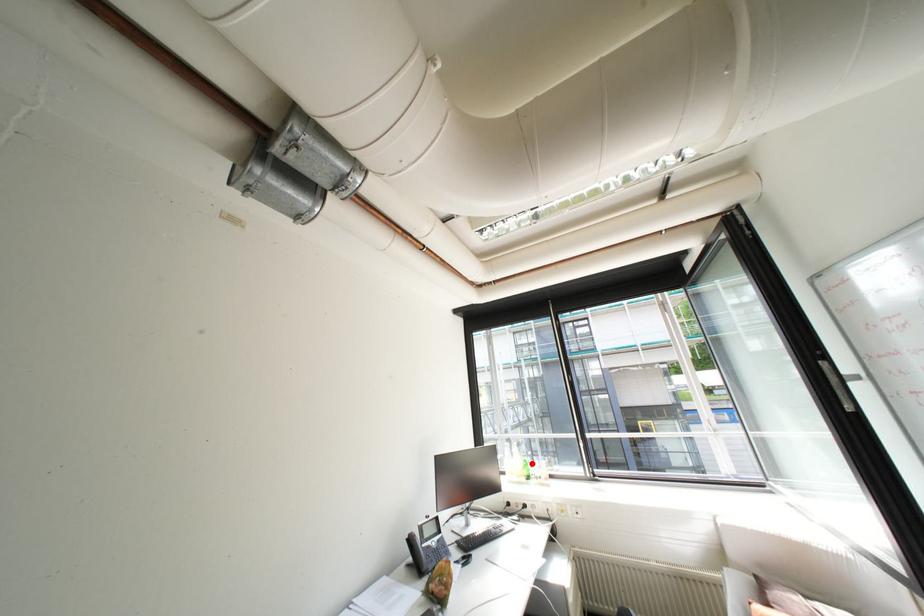
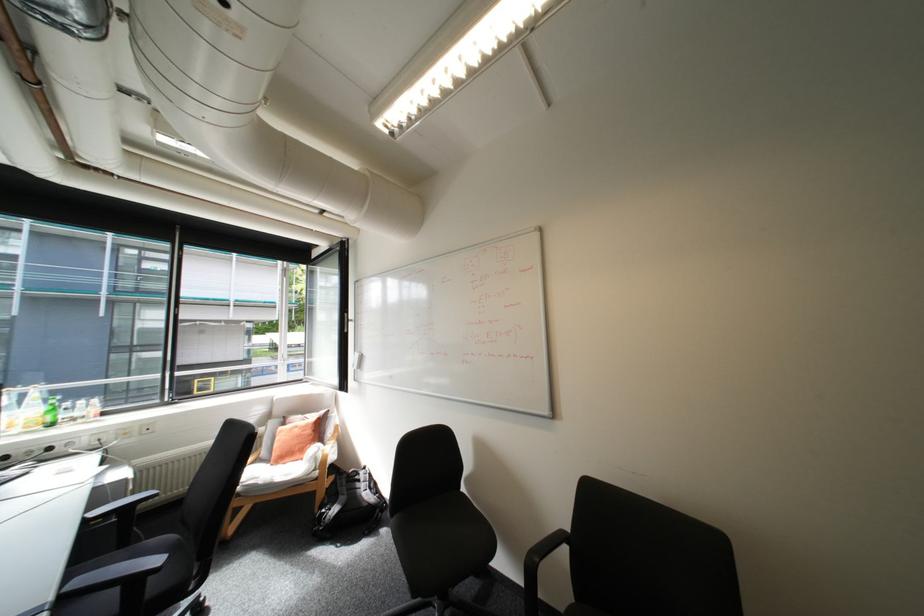
The point at the highlighted location is marked in the first image. Where is the corresponding point in the second image?

(55, 408)